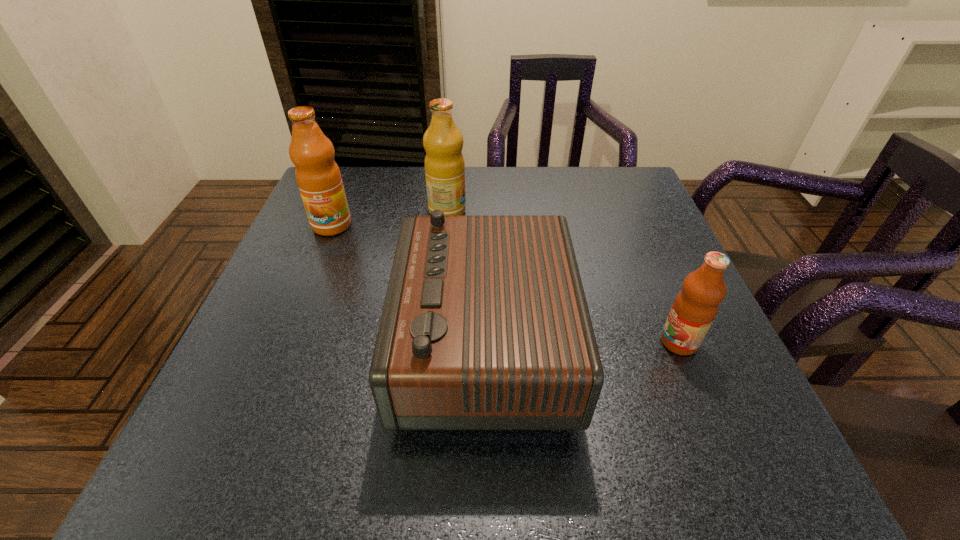
Where is `vacant point located 0.280m on the tuning display of the radio receiver`? vacant point located 0.280m on the tuning display of the radio receiver is located at coordinates (249, 343).

This screenshot has height=540, width=960. I want to click on free spot located 0.170m on the tuning display of the radio receiver, so click(x=309, y=343).

The height and width of the screenshot is (540, 960). In order to click on vacant space located on the tuning display of the radio receiver in this screenshot , I will do `click(370, 343)`.

Locate an element on the screen. The image size is (960, 540). object at the near edge is located at coordinates (485, 326).

In order to click on object located at the left edge in this screenshot , I will do `click(319, 180)`.

This screenshot has width=960, height=540. I want to click on object situated at the right edge, so click(695, 307).

The width and height of the screenshot is (960, 540). Find the location of `object that is at the far left corner`. object that is at the far left corner is located at coordinates (319, 180).

Locate an element on the screen. Image resolution: width=960 pixels, height=540 pixels. vacant area at the far edge is located at coordinates (555, 209).

In the image, there is a desktop. Identify the location of vacant space at the near edge. (642, 448).

Image resolution: width=960 pixels, height=540 pixels. Identify the location of free space at the left edge of the desktop. (326, 337).